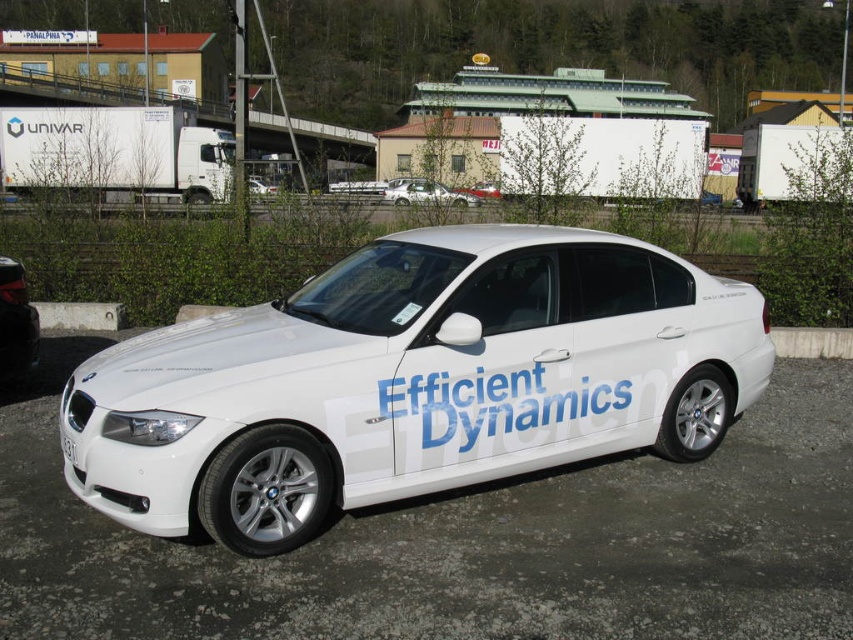
Question: Which point is closer to the camera?

Choices:
 (A) silver metallic sedan at center
 (B) white concrete curb at lower right
 (C) white glossy car at lower left
 (D) white metallic car at center

Answer: (D)

Question: Estimate the real-world distances between objects in this image. Which object is farther from the white plastic license plate at center?

Choices:
 (A) gray concrete curb at lower left
 (B) white matte sedan at center
 (C) white metallic car at center

Answer: (B)

Question: Is white metallic car at center wider than white glossy car at lower left?

Choices:
 (A) no
 (B) yes

Answer: (B)

Question: Which object is positioned closest to the gray concrete curb at lower left?

Choices:
 (A) white concrete curb at lower right
 (B) white glossy car at lower left
 (C) white metallic car at center

Answer: (B)

Question: Does white car at center come in front of white matte sedan at center?

Choices:
 (A) no
 (B) yes

Answer: (B)

Question: Is silver metallic sedan at center below white plastic license plate at center?

Choices:
 (A) yes
 (B) no

Answer: (B)